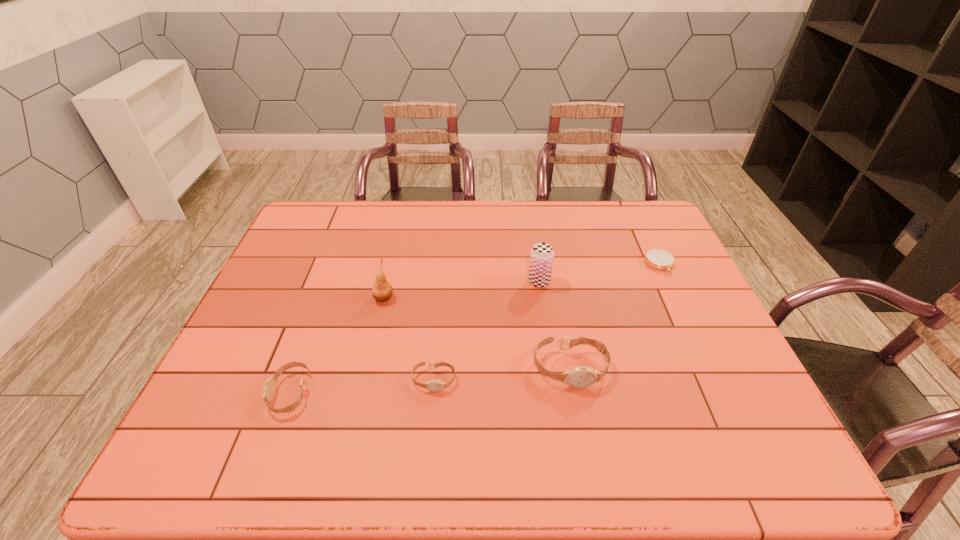
This screenshot has width=960, height=540. In order to click on free space between the second watch from right to left and the tallest watch in this screenshot , I will do `click(502, 374)`.

Locate an element on the screen. blank region between the beer can and the shortest object is located at coordinates (600, 273).

You are a GUI agent. You are given a task and a screenshot of the screen. Output one action in this format:
    pyautogui.click(x=<x>, y=<y>)
    Task: Click on the vacant space that is in between the rightmost watch and the fifth object from right to left
    
    Given the screenshot: What is the action you would take?
    pyautogui.click(x=477, y=333)

Locate an element on the screen. The height and width of the screenshot is (540, 960). unoccupied area between the rightmost object and the beer can is located at coordinates (600, 273).

You are a GUI agent. You are given a task and a screenshot of the screen. Output one action in this format:
    pyautogui.click(x=<x>, y=<y>)
    Task: Click on the vacant space that is in between the beer can and the shortest watch
    The height and width of the screenshot is (540, 960).
    Given the screenshot: What is the action you would take?
    pyautogui.click(x=487, y=330)

Identify the location of vacant area between the rightmost object and the pear. The image size is (960, 540). (522, 281).

Identify which object is located as the fourth nearest to the leftmost object. Please provide its 2D coordinates. Your answer should be formatted as a tuple, i.e. [(x, y)], where the tuple contains the x and y coordinates of a point satisfying the conditions above.

[(542, 254)]

What are the coordinates of `object that ranks as the fifth closest to the beer can` in the screenshot? It's located at 269,389.

This screenshot has height=540, width=960. In order to click on watch that is the closest one to the rightmost watch in this screenshot , I will do `click(434, 385)`.

Locate an element on the screen. The height and width of the screenshot is (540, 960). watch that stands as the third closest to the beer can is located at coordinates (269, 389).